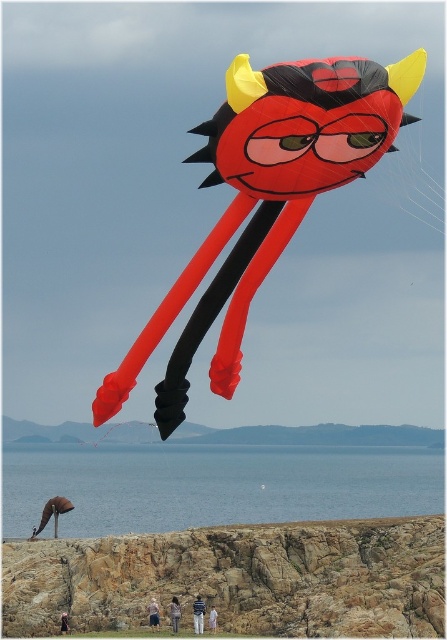
Question: Which point is farther to the camera?

Choices:
 (A) (324, 556)
 (B) (354, 506)
 (C) (151, 627)

Answer: (B)

Question: Is matte plastic kite at upper center smaller than light brown hair at lower center?

Choices:
 (A) no
 (B) yes

Answer: (A)

Question: Which point appears farthest from the camera in this image?

Choices:
 (A) (338, 72)
 (B) (64, 628)
 (C) (160, 452)

Answer: (C)

Question: Which object appears closest to the camera in this image?

Choices:
 (A) white cotton pants at lower center
 (B) pink fabric person at lower center

Answer: (A)

Question: Does white cotton pants at lower center appear on the left side of white cotton shirt at lower center?

Choices:
 (A) no
 (B) yes

Answer: (B)

Question: Where is brown rocky cliff at lower center located in relation to matte plastic kite at upper center in the image?

Choices:
 (A) left
 (B) right

Answer: (A)